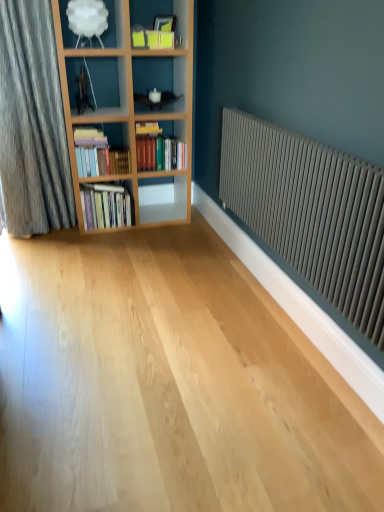
Question: Is hardcover books at left, which is the 3th book in top-to-bottom order, facing away from matte gray radiator at right?

Choices:
 (A) yes
 (B) no

Answer: (B)

Question: Is hardcover books at left, which is the 3th book in top-to-bottom order, not within matte gray radiator at right?

Choices:
 (A) yes
 (B) no

Answer: (A)

Question: From the image's perspective, is hardcover books at left, marked as the 1th book in a bottom-to-top arrangement, over matte gray radiator at right?

Choices:
 (A) yes
 (B) no

Answer: (A)

Question: Does hardcover books at left, marked as the 1th book in a bottom-to-top arrangement, turn towards matte gray radiator at right?

Choices:
 (A) no
 (B) yes

Answer: (B)

Question: Is hardcover books at left, marked as the 1th book in a bottom-to-top arrangement, to the right of matte gray radiator at right from the viewer's perspective?

Choices:
 (A) no
 (B) yes

Answer: (A)

Question: Considering the relative positions of matte gray radiator at right and hardcover books at left, placed as the second book when sorted from top to bottom, in the image provided, is matte gray radiator at right to the left or to the right of hardcover books at left, placed as the second book when sorted from top to bottom,?

Choices:
 (A) left
 (B) right

Answer: (B)

Question: Which is correct: matte gray radiator at right is inside hardcover books at left, the 2th book from the bottom, or outside of it?

Choices:
 (A) outside
 (B) inside

Answer: (A)

Question: Is point (306, 219) positioned closer to the camera than point (114, 173)?

Choices:
 (A) farther
 (B) closer

Answer: (B)

Question: From a real-world perspective, relative to hardcover books at left, placed as the second book when sorted from top to bottom, is matte gray radiator at right vertically above or below?

Choices:
 (A) above
 (B) below

Answer: (A)

Question: Would you say white matte lampshade at upper left, the 1th shelf when ordered from top to bottom, is inside or outside hardcover books at center, the third book when ordered from bottom to top?

Choices:
 (A) inside
 (B) outside

Answer: (B)

Question: From the image's perspective, relative to hardcover books at center, the third book when ordered from bottom to top, is white matte lampshade at upper left, marked as the 2th shelf in a bottom-to-top arrangement, above or below?

Choices:
 (A) above
 (B) below

Answer: (A)

Question: Considering the positions of white matte lampshade at upper left, marked as the 1th shelf in a front-to-back arrangement, and hardcover books at center, the third book when ordered from bottom to top, in the image, is white matte lampshade at upper left, marked as the 1th shelf in a front-to-back arrangement, bigger or smaller than hardcover books at center, the third book when ordered from bottom to top,?

Choices:
 (A) big
 (B) small

Answer: (B)

Question: Is white matte lampshade at upper left, the 1th shelf when ordered from top to bottom, wider or thinner than hardcover books at center, the third book when ordered from bottom to top?

Choices:
 (A) wide
 (B) thin

Answer: (B)

Question: From their relative heights in the image, would you say matte gray radiator at right is taller or shorter than hardcover books at center, the first book positioned from the top?

Choices:
 (A) tall
 (B) short

Answer: (A)

Question: Looking at their shapes, would you say matte gray radiator at right is wider or thinner than hardcover books at center, the third book when ordered from bottom to top?

Choices:
 (A) wide
 (B) thin

Answer: (B)